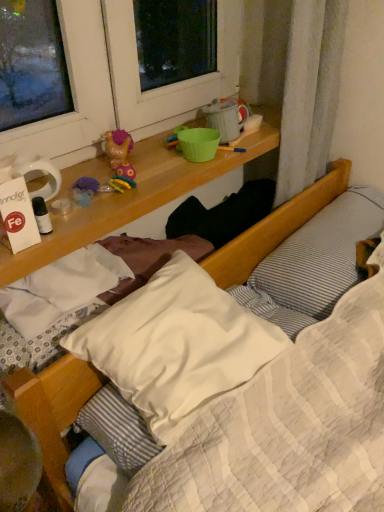
Question: Is white soft pillow at center, the first pillow from the left, facing towards white striped pillow at upper right, acting as the first pillow starting from the right?

Choices:
 (A) no
 (B) yes

Answer: (A)

Question: From the image's perspective, is white soft pillow at center, the first pillow from the left, located above white striped pillow at upper right, acting as the first pillow starting from the right?

Choices:
 (A) yes
 (B) no

Answer: (B)

Question: Considering the relative positions of white soft pillow at center, the first pillow from the left, and white striped pillow at upper right, the 2th pillow when ordered from left to right, in the image provided, is white soft pillow at center, the first pillow from the left, to the right of white striped pillow at upper right, the 2th pillow when ordered from left to right, from the viewer's perspective?

Choices:
 (A) no
 (B) yes

Answer: (A)

Question: Can you confirm if white soft pillow at center, the 2th pillow positioned from the right, is shorter than white striped pillow at upper right, the 2th pillow when ordered from left to right?

Choices:
 (A) no
 (B) yes

Answer: (B)

Question: From a real-world perspective, is white soft pillow at center, the first pillow from the left, below white striped pillow at upper right, the 2th pillow when ordered from left to right?

Choices:
 (A) yes
 (B) no

Answer: (A)

Question: From the image's perspective, is white soft pillow at center, the 2th pillow positioned from the right, positioned above or below gold plastic toy at upper center?

Choices:
 (A) above
 (B) below

Answer: (B)

Question: Is white soft pillow at center, the first pillow from the left, in front of or behind gold plastic toy at upper center in the image?

Choices:
 (A) front
 (B) behind

Answer: (A)

Question: Is white soft pillow at center, the first pillow from the left, bigger or smaller than gold plastic toy at upper center?

Choices:
 (A) big
 (B) small

Answer: (A)

Question: Is white soft pillow at center, the first pillow from the left, situated inside gold plastic toy at upper center or outside?

Choices:
 (A) inside
 (B) outside

Answer: (B)

Question: From a real-world perspective, is white striped pillow at upper right, the 2th pillow when ordered from left to right, physically located above or below gold plastic toy at upper center?

Choices:
 (A) above
 (B) below

Answer: (B)

Question: Would you say white striped pillow at upper right, acting as the first pillow starting from the right, is to the left or to the right of gold plastic toy at upper center in the picture?

Choices:
 (A) left
 (B) right

Answer: (B)

Question: Is white striped pillow at upper right, acting as the first pillow starting from the right, inside the boundaries of gold plastic toy at upper center, or outside?

Choices:
 (A) inside
 (B) outside

Answer: (B)

Question: Is point (286, 304) closer or farther from the camera than point (122, 134)?

Choices:
 (A) farther
 (B) closer

Answer: (A)

Question: From a real-world perspective, is gold plastic toy at upper center physically located above or below white soft pillow at center, the 2th pillow positioned from the right?

Choices:
 (A) above
 (B) below

Answer: (A)

Question: Is gold plastic toy at upper center bigger or smaller than white soft pillow at center, the first pillow from the left?

Choices:
 (A) small
 (B) big

Answer: (A)